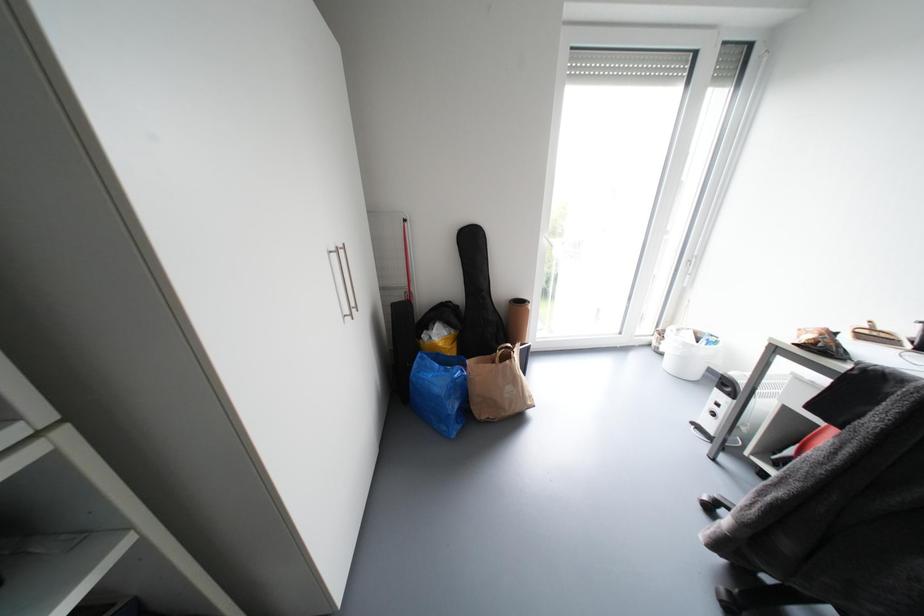
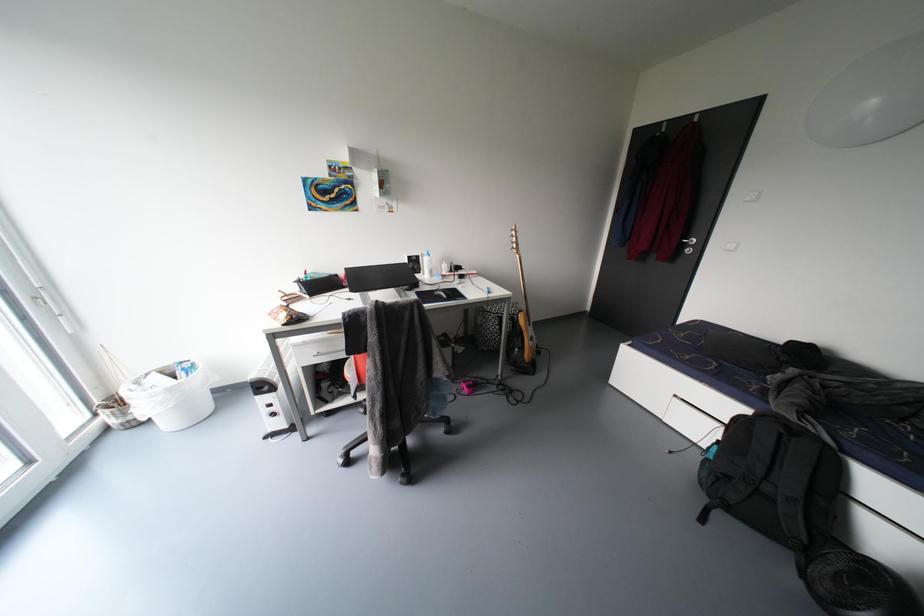
How did the camera likely rotate?

The camera's rotation is toward right-down.